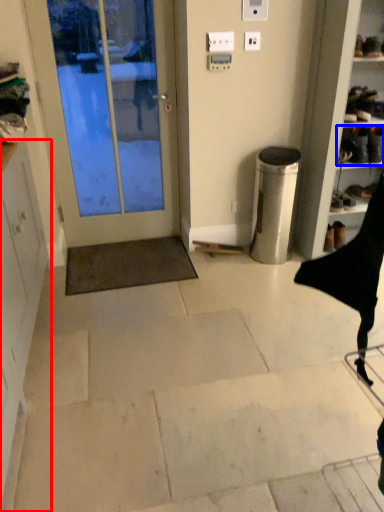
Question: Which object appears farthest to the camera in this image, cabinetry (highlighted by a red box) or footwear (highlighted by a blue box)?

Choices:
 (A) cabinetry
 (B) footwear

Answer: (B)